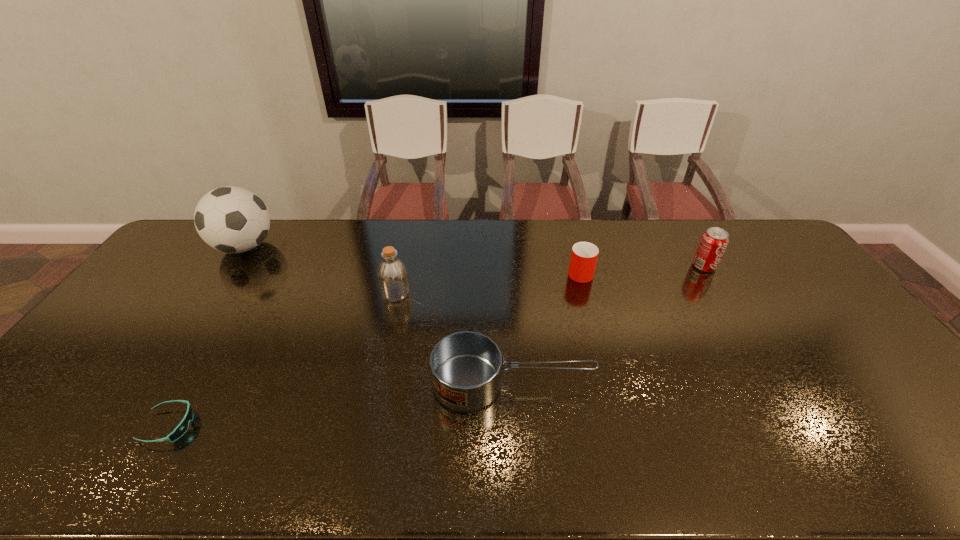
Locate an element on the screen. the tallest object is located at coordinates (231, 219).

You are a GUI agent. You are given a task and a screenshot of the screen. Output one action in this format:
    pyautogui.click(x=<x>, y=<y>)
    Task: Click on the fifth shortest object
    The height and width of the screenshot is (540, 960).
    Given the screenshot: What is the action you would take?
    pyautogui.click(x=392, y=273)

Locate an element on the screen. the fourth object from right to left is located at coordinates (392, 273).

Where is `the fourth shortest object`? The height and width of the screenshot is (540, 960). the fourth shortest object is located at coordinates (713, 243).

The height and width of the screenshot is (540, 960). What are the coordinates of `soda` in the screenshot? It's located at (713, 243).

The image size is (960, 540). I want to click on the second object from right to left, so click(x=584, y=255).

Locate an element on the screen. This screenshot has width=960, height=540. saucepan is located at coordinates (465, 366).

The image size is (960, 540). In order to click on the shortest object in this screenshot , I will do `click(181, 429)`.

Locate an element on the screen. vacant space located 0.280m on the front of the soccer ball is located at coordinates (191, 328).

The image size is (960, 540). I want to click on vacant space positioned on the front of the bottle, so click(381, 363).